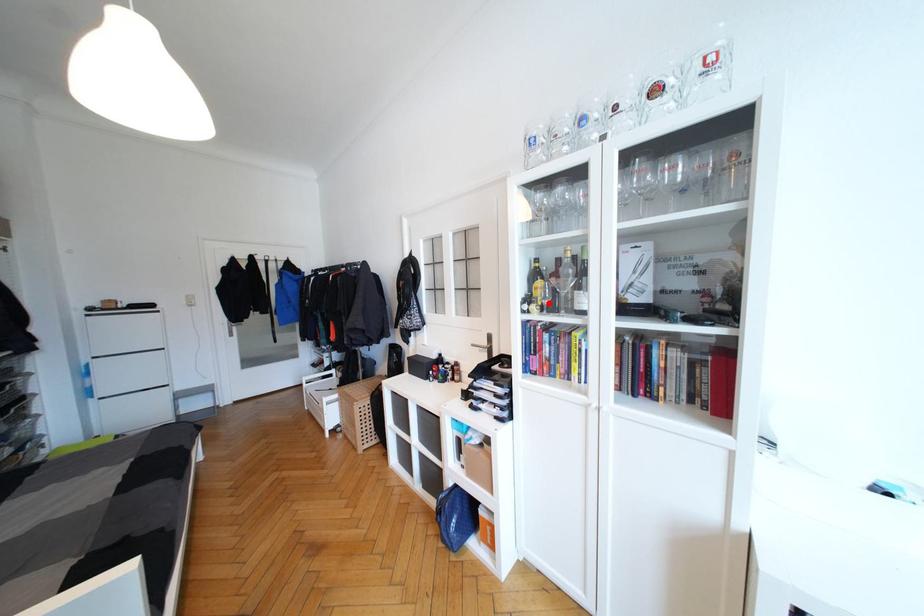
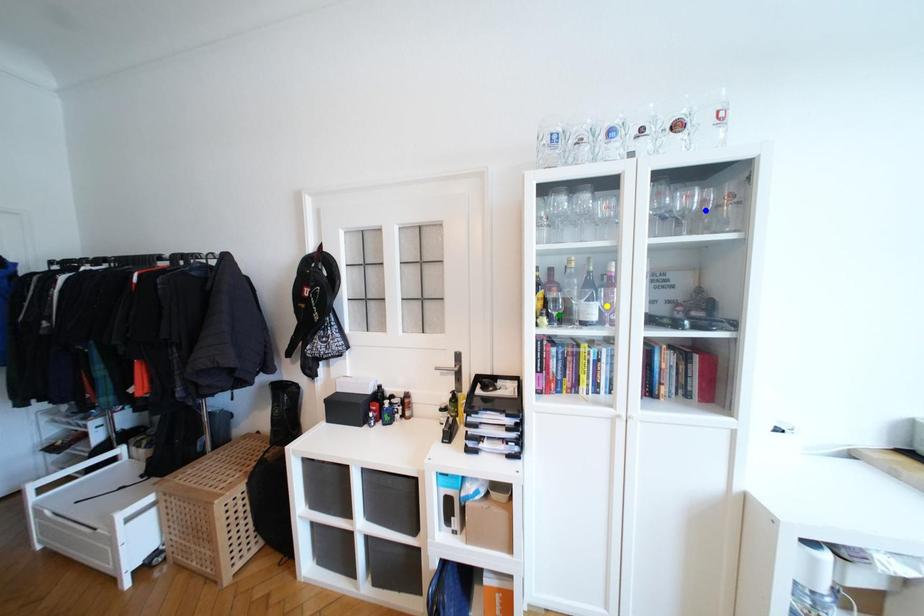
Question: I am providing you with two images of the same scene from different viewpoints. A red point is marked on the first image. You are given multiple points on the second image. Which spot in image 2 lines up with the point in image 1?

Choices:
 (A) green point
 (B) yellow point
 (C) blue point

Answer: (A)